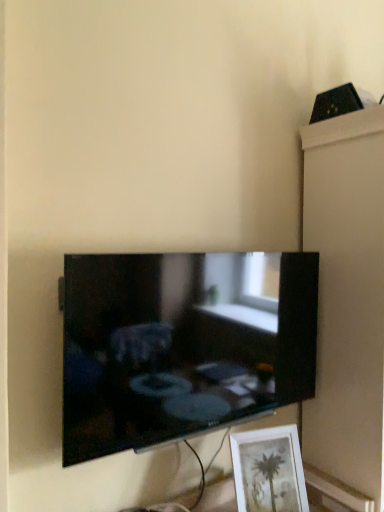
Question: Can you confirm if matte white picture frame at lower right is thinner than white glossy cabinet at upper right?

Choices:
 (A) no
 (B) yes

Answer: (B)

Question: Is matte white picture frame at lower right smaller than white glossy cabinet at upper right?

Choices:
 (A) yes
 (B) no

Answer: (A)

Question: Is white glossy cabinet at upper right inside matte white picture frame at lower right?

Choices:
 (A) yes
 (B) no

Answer: (B)

Question: Is matte white picture frame at lower right behind white glossy cabinet at upper right?

Choices:
 (A) yes
 (B) no

Answer: (B)

Question: Can you confirm if matte white picture frame at lower right is taller than white glossy cabinet at upper right?

Choices:
 (A) yes
 (B) no

Answer: (B)

Question: In the image, is white glossy cabinet at upper right on the left side or the right side of matte white picture frame at lower right?

Choices:
 (A) right
 (B) left

Answer: (A)

Question: Is white glossy cabinet at upper right wider or thinner than matte white picture frame at lower right?

Choices:
 (A) wide
 (B) thin

Answer: (A)

Question: Considering the positions of white glossy cabinet at upper right and matte white picture frame at lower right in the image, is white glossy cabinet at upper right bigger or smaller than matte white picture frame at lower right?

Choices:
 (A) small
 (B) big

Answer: (B)

Question: From their relative heights in the image, would you say white glossy cabinet at upper right is taller or shorter than matte white picture frame at lower right?

Choices:
 (A) tall
 (B) short

Answer: (A)

Question: Considering their positions, is black glossy tv at center located in front of or behind matte white picture frame at lower right?

Choices:
 (A) behind
 (B) front

Answer: (B)

Question: Is point (94, 300) positioned closer to the camera than point (273, 501)?

Choices:
 (A) farther
 (B) closer

Answer: (B)

Question: In terms of height, does black glossy tv at center look taller or shorter compared to matte white picture frame at lower right?

Choices:
 (A) tall
 (B) short

Answer: (A)

Question: From a real-world perspective, is black glossy tv at center above or below matte white picture frame at lower right?

Choices:
 (A) below
 (B) above

Answer: (B)

Question: Looking at the image, does matte white picture frame at lower right seem bigger or smaller compared to white glossy cabinet at upper right?

Choices:
 (A) big
 (B) small

Answer: (B)

Question: In the image, is matte white picture frame at lower right on the left side or the right side of white glossy cabinet at upper right?

Choices:
 (A) left
 (B) right

Answer: (A)